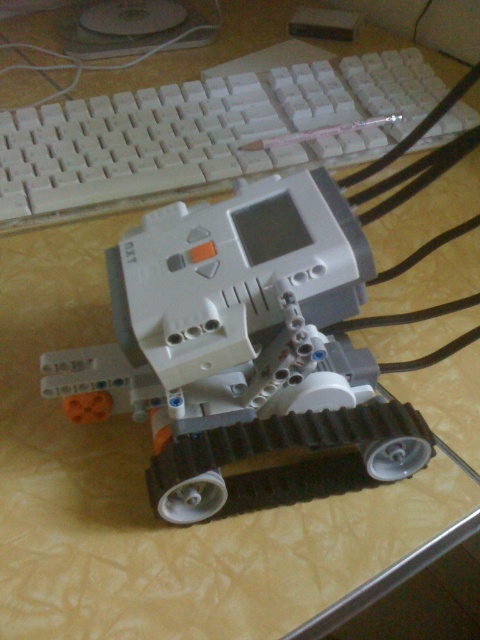
Question: Does white plastic robot at center appear under white plastic keyboard at upper center?

Choices:
 (A) yes
 (B) no

Answer: (A)

Question: Can you confirm if white plastic robot at center is positioned above white plastic keyboard at upper center?

Choices:
 (A) yes
 (B) no

Answer: (B)

Question: Which object appears closest to the camera in this image?

Choices:
 (A) white plastic keyboard at upper center
 (B) white plastic robot at center

Answer: (B)

Question: Among these objects, which one is farthest from the camera?

Choices:
 (A) white plastic robot at center
 (B) white plastic keyboard at upper center

Answer: (B)

Question: Is white plastic robot at center further to the viewer compared to white plastic keyboard at upper center?

Choices:
 (A) no
 (B) yes

Answer: (A)

Question: Which of the following is the closest to the observer?

Choices:
 (A) (44, 186)
 (B) (80, 385)

Answer: (B)